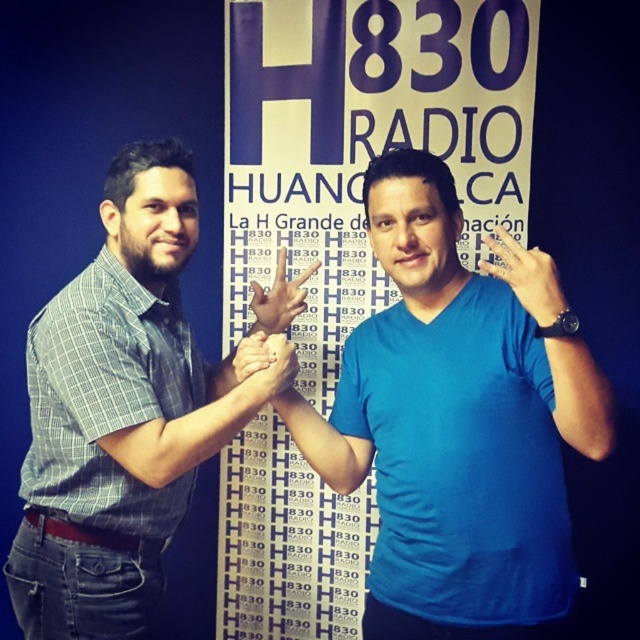
Can you confirm if gray checkered shirt at center is positioned above matte blue hand at center?

No.

Consider the image. Between gray checkered shirt at center and matte blue hand at center, which one appears on the left side from the viewer's perspective?

gray checkered shirt at center is more to the left.

Is point (22, 616) more distant than point (509, 259)?

Yes, point (22, 616) is farther from viewer.

The image size is (640, 640). Identify the location of gray checkered shirt at center. (118, 413).

Is blue fabric poster at center shorter than gray checkered shirt at center?

Incorrect, blue fabric poster at center's height does not fall short of gray checkered shirt at center's.

Does blue fabric poster at center have a greater width compared to gray checkered shirt at center?

Indeed, blue fabric poster at center has a greater width compared to gray checkered shirt at center.

The height and width of the screenshot is (640, 640). Identify the location of blue fabric poster at center. (364, 141).

Who is positioned more to the left, matte black hand at center or matte skin hand at center?

matte skin hand at center is more to the left.

Does matte black hand at center appear on the left side of matte skin hand at center?

Incorrect, matte black hand at center is not on the left side of matte skin hand at center.

Who is more forward, (252, 282) or (282, 337)?

Point (282, 337) is more forward.

Find the location of a particular element. matte black hand at center is located at coordinates (280, 298).